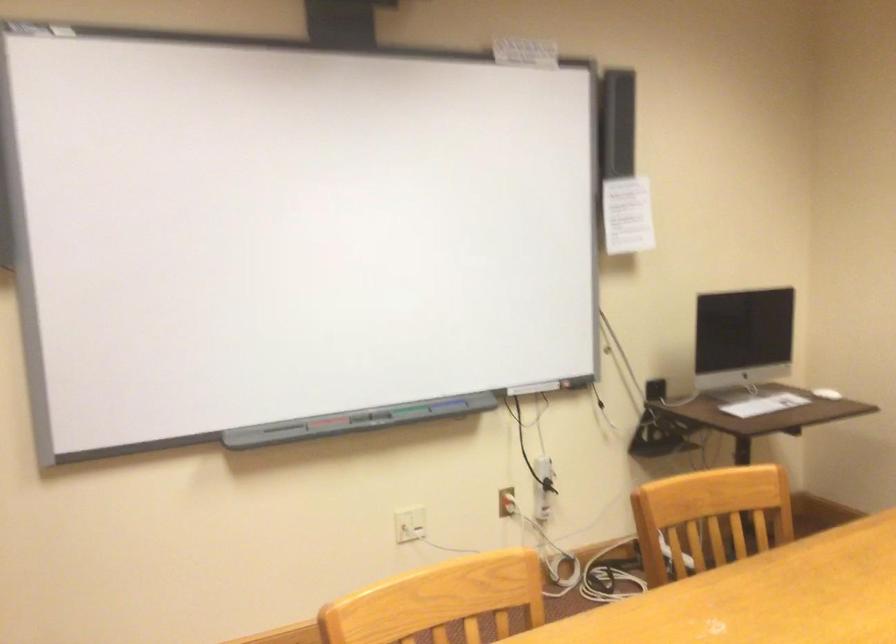
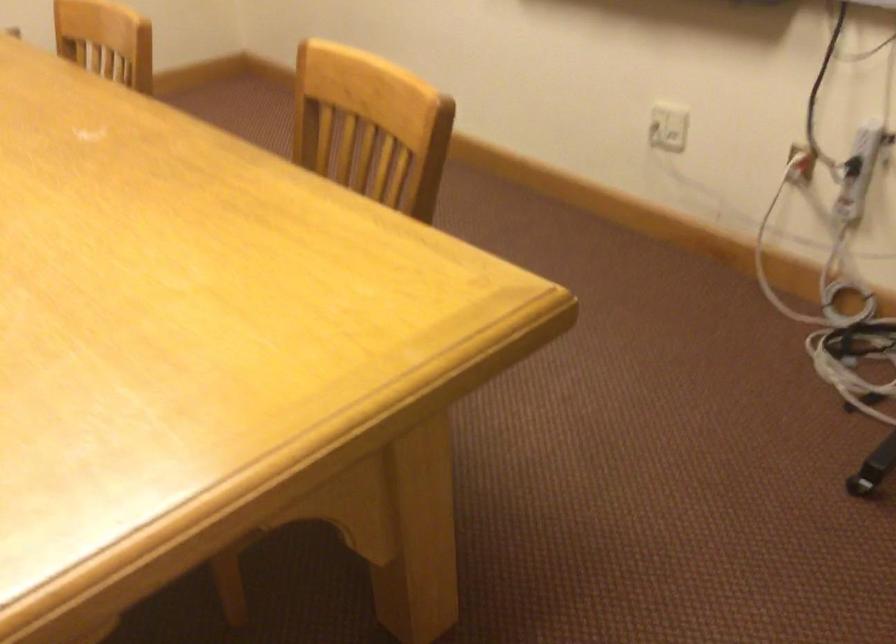
Locate, in the second image, the point that corresponds to the point at 515,498 in the first image.

(800, 164)